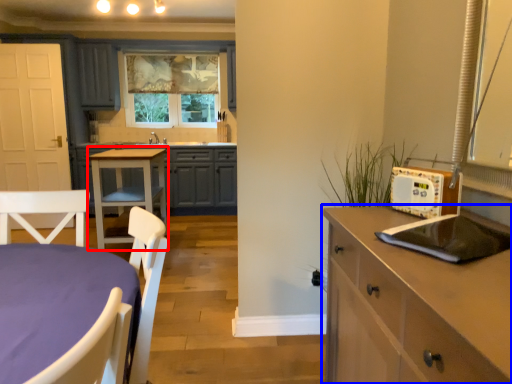
Question: Which of the following is the farthest to the observer, table (highlighted by a red box) or cabinetry (highlighted by a blue box)?

Choices:
 (A) table
 (B) cabinetry

Answer: (A)